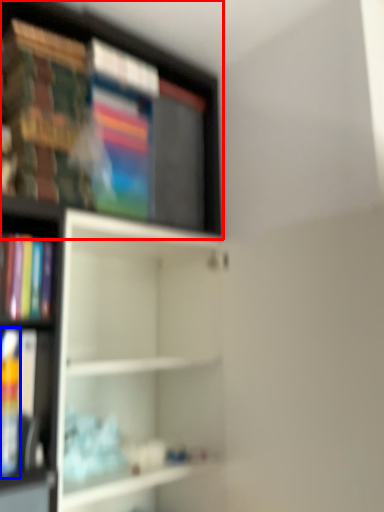
Question: Among these objects, which one is farthest to the camera, shelf (highlighted by a red box) or book (highlighted by a blue box)?

Choices:
 (A) shelf
 (B) book

Answer: (A)